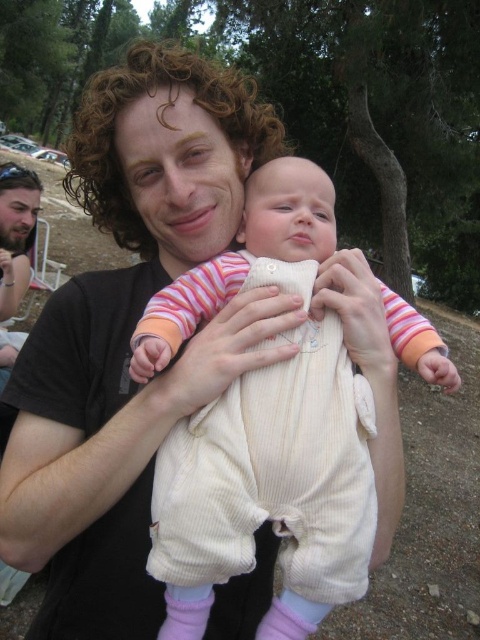
You are a photographer trying to capture a closeup of the baby in the striped pink and white outfit. Since the white corduroy onesie at center and the cream corduroy baby at center are both at the center, which one should you focus on to get the baby?

The cream corduroy baby at center is the actual baby, while the white corduroy onesie at center is its clothing. To capture the baby, focus on the cream corduroy baby at center since it is smaller in size than the white corduroy onesie at center, which is the clothing item worn by the baby.

In the scene shown: You are a photographer trying to capture the baby in the white corduroy onesie at center. The camera has a focus point at coordinates 0.766, 0.562. Will the camera focus on the baby?

Yes, the camera will focus on the baby because the white corduroy onesie at center is exactly at the coordinates (269, 490) where the focus point is located.